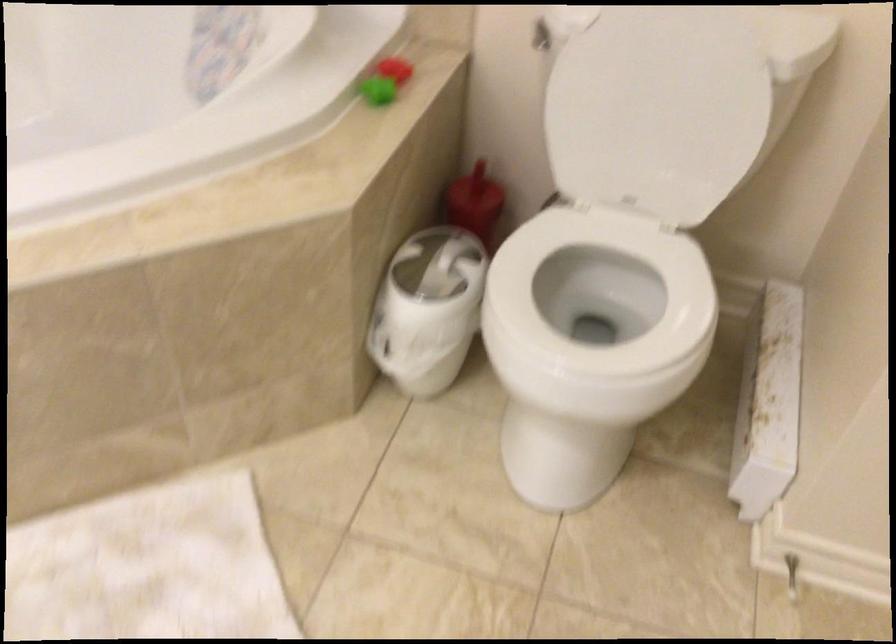
In order to click on trash can lid in this screenshot , I will do `click(427, 308)`.